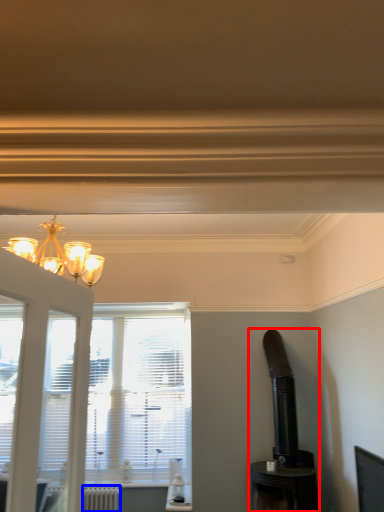
Question: Which object appears closest to the camera in this image, appliance (highlighted by a red box) or radiator (highlighted by a blue box)?

Choices:
 (A) appliance
 (B) radiator

Answer: (A)